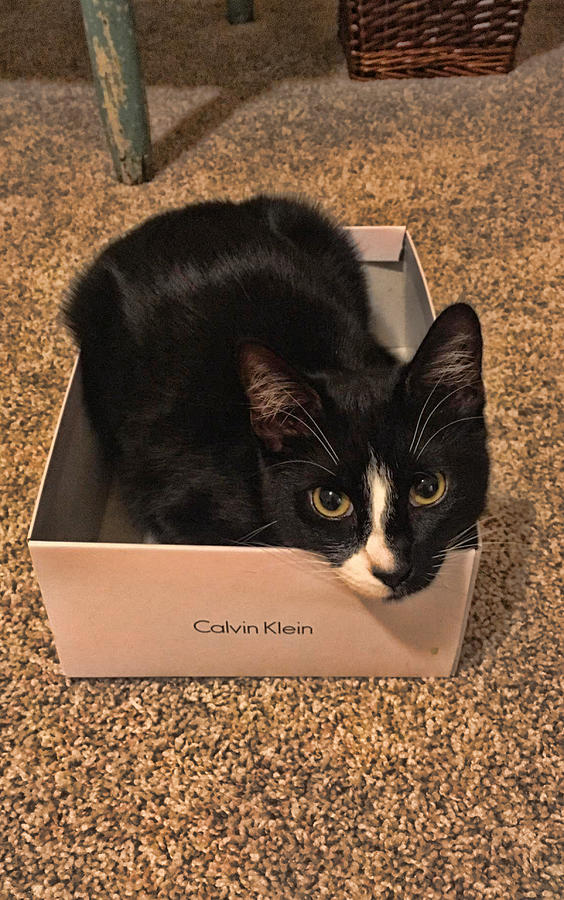
Image resolution: width=564 pixels, height=900 pixels. In order to click on carpet to side of box in this screenshot , I will do `click(527, 324)`, `click(22, 392)`.